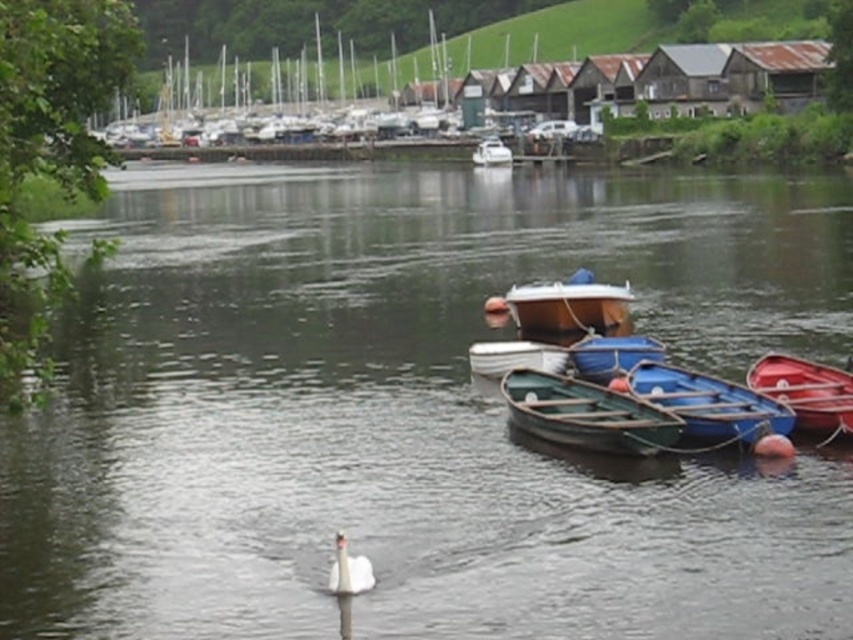
Question: Which of the following is the farthest from the observer?

Choices:
 (A) white glossy swan at lower center
 (B) red glossy canoe at right
 (C) blue wood canoe at right
 (D) white glossy boat at center

Answer: (D)

Question: Which point is farther from the camera taking this photo?

Choices:
 (A) (338, 531)
 (B) (561, 412)

Answer: (B)

Question: From the image, what is the correct spatial relationship of red glossy canoe at right in relation to white glossy boat at center?

Choices:
 (A) left
 (B) right

Answer: (B)

Question: Can you confirm if red glossy canoe at right is bigger than white glossy swan at lower center?

Choices:
 (A) no
 (B) yes

Answer: (B)

Question: Which point is farther to the camera?

Choices:
 (A) (664, 390)
 (B) (534, 396)

Answer: (B)

Question: Can you confirm if blue wood canoe at right is positioned below red glossy canoe at right?

Choices:
 (A) yes
 (B) no

Answer: (A)